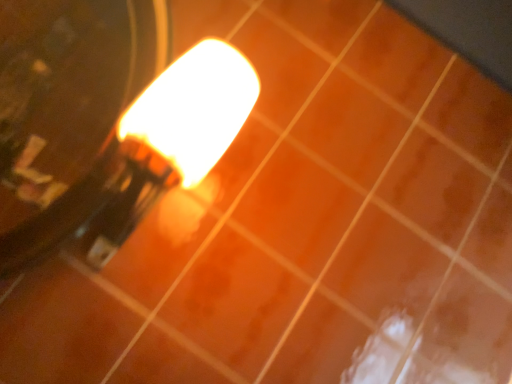
The width and height of the screenshot is (512, 384). What do you see at coordinates (146, 156) in the screenshot?
I see `matte glass lamp at center` at bounding box center [146, 156].

Find the location of a particular element. Image resolution: width=512 pixels, height=384 pixels. matte glass lamp at center is located at coordinates click(x=146, y=156).

Find the location of a particular element. The height and width of the screenshot is (384, 512). matte glass lamp at center is located at coordinates (146, 156).